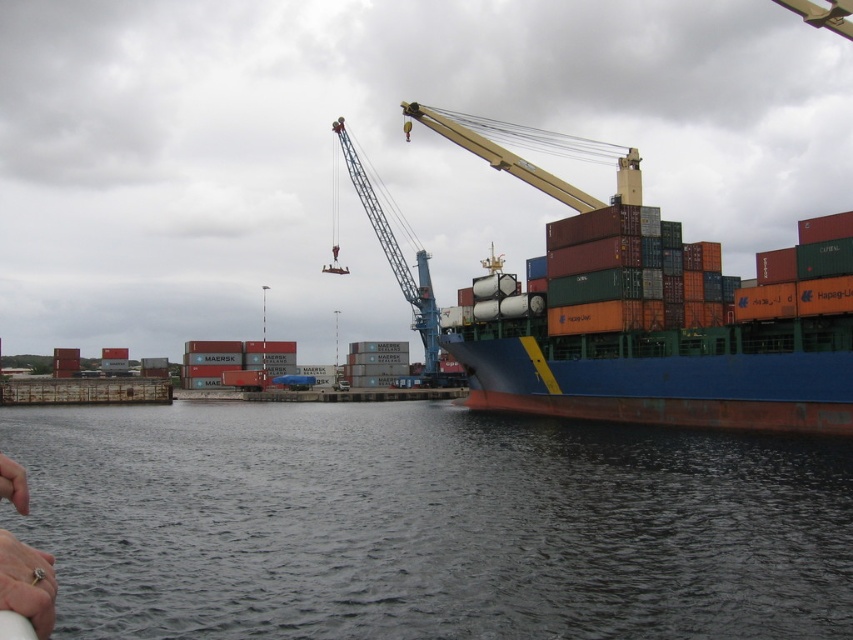
Is dark gray water at center smaller than yellow metallic crane at upper center?

Yes, dark gray water at center is smaller than yellow metallic crane at upper center.

Looking at this image, which is more to the left, dark gray water at center or yellow metallic crane at upper center?

yellow metallic crane at upper center is more to the left.

Measure the distance between point (408, 609) and camera.

40.25 meters

At what (x,y) coordinates should I click in order to perform the action: click on dark gray water at center. Please return your answer as a coordinate pair (x, y). This screenshot has height=640, width=853. Looking at the image, I should click on (428, 524).

Is point (584, 534) closer to viewer compared to point (26, 484)?

No, it is not.

This screenshot has width=853, height=640. Find the location of `dark gray water at center`. dark gray water at center is located at coordinates (428, 524).

Find the location of a particular element. This screenshot has width=853, height=640. dark gray water at center is located at coordinates (428, 524).

Does dark gray water at center appear over blue matte container ship at center?

Incorrect, dark gray water at center is not positioned above blue matte container ship at center.

Between dark gray water at center and blue matte container ship at center, which one is positioned lower?

dark gray water at center is below.

Does point (595, 612) lie behind point (589, 244)?

No.

Locate an element on the screen. Image resolution: width=853 pixels, height=640 pixels. dark gray water at center is located at coordinates (428, 524).